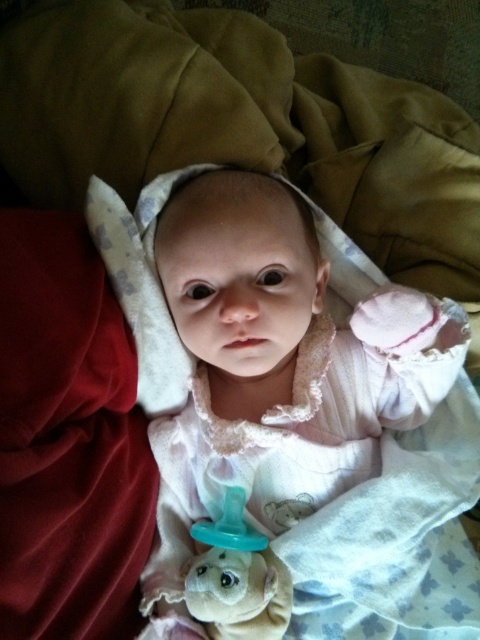
Can you confirm if white soft baby at center is thinner than teal rubber pacifier at center?

No.

Is white soft baby at center smaller than teal rubber pacifier at center?

Incorrect, white soft baby at center is not smaller in size than teal rubber pacifier at center.

Does point (255, 300) lie behind point (264, 609)?

Yes, it is.

I want to click on white soft baby at center, so click(x=276, y=369).